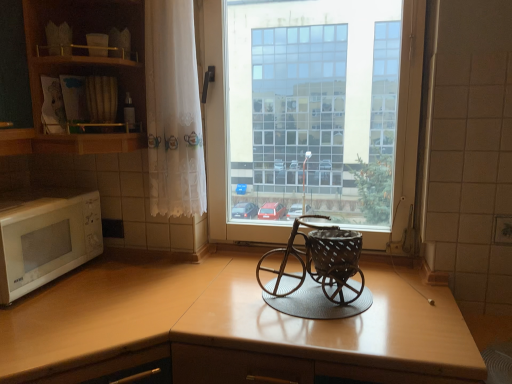
Where is `spots to the right of rustic metal bicycle at center`? This screenshot has width=512, height=384. spots to the right of rustic metal bicycle at center is located at coordinates (399, 295).